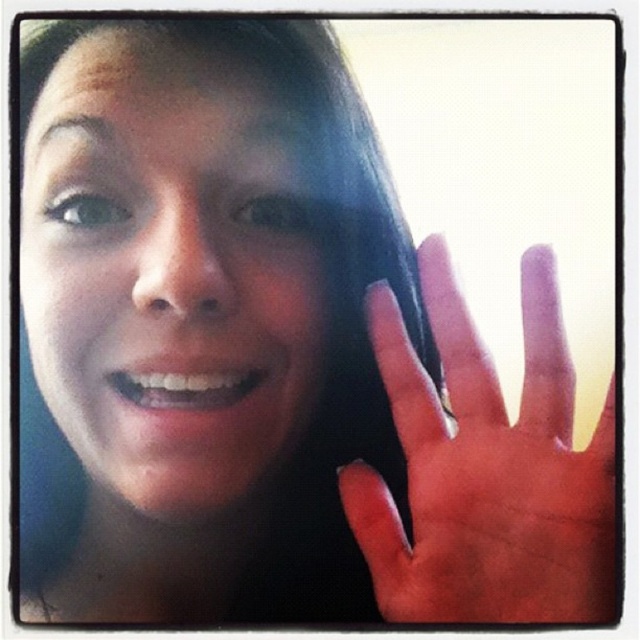
Question: Is smooth skin face at center to the right of dry skin hand at right from the viewer's perspective?

Choices:
 (A) no
 (B) yes

Answer: (A)

Question: Can you confirm if smooth skin face at center is smaller than dry skin hand at right?

Choices:
 (A) yes
 (B) no

Answer: (B)

Question: Is smooth skin face at center bigger than dry skin hand at right?

Choices:
 (A) no
 (B) yes

Answer: (B)

Question: Which object is closer to the camera taking this photo?

Choices:
 (A) smooth skin face at center
 (B) dry skin hand at right

Answer: (B)